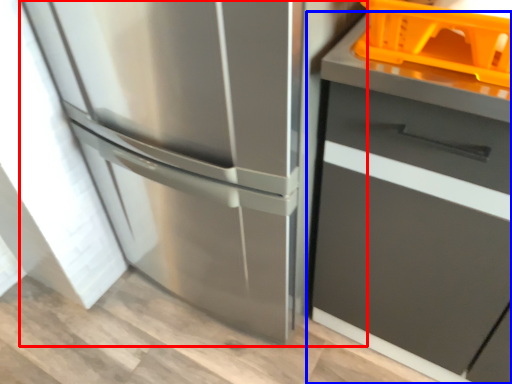
Question: Which of the following is the farthest to the observer, refrigerator (highlighted by a red box) or cabinetry (highlighted by a blue box)?

Choices:
 (A) refrigerator
 (B) cabinetry

Answer: (A)